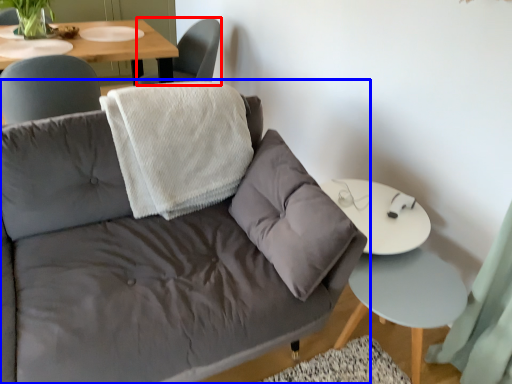
Question: Which object is closer to the camera taking this photo, chair (highlighted by a red box) or studio couch (highlighted by a blue box)?

Choices:
 (A) chair
 (B) studio couch

Answer: (B)